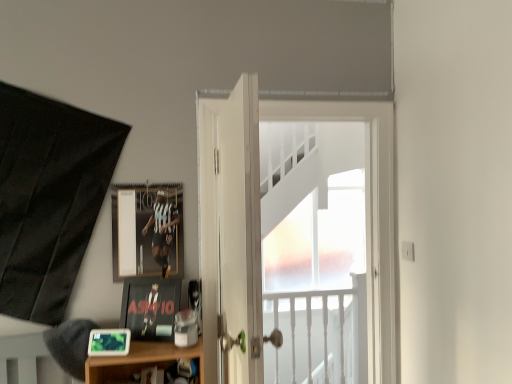
Question: Considering the relative positions of matte black picture frame at lower left, acting as the 3th picture frame starting from the top, and white glossy door at center, positioned as the second door in front-to-back order, in the image provided, is matte black picture frame at lower left, acting as the 3th picture frame starting from the top, to the right of white glossy door at center, positioned as the second door in front-to-back order, from the viewer's perspective?

Choices:
 (A) no
 (B) yes

Answer: (A)

Question: Is matte black picture frame at lower left, which is the 1th picture frame from front to back, smaller than white glossy door at center, marked as the first door in a back-to-front arrangement?

Choices:
 (A) no
 (B) yes

Answer: (B)

Question: Does matte black picture frame at lower left, the third picture frame from the back, lie in front of white glossy door at center, marked as the first door in a back-to-front arrangement?

Choices:
 (A) no
 (B) yes

Answer: (B)

Question: From the image's perspective, is matte black picture frame at lower left, which is the 1th picture frame from front to back, below white glossy door at center, marked as the first door in a back-to-front arrangement?

Choices:
 (A) yes
 (B) no

Answer: (A)

Question: Considering the relative sizes of matte black picture frame at lower left, which is the 1th picture frame from front to back, and white glossy door at center, marked as the first door in a back-to-front arrangement, in the image provided, is matte black picture frame at lower left, which is the 1th picture frame from front to back, taller than white glossy door at center, marked as the first door in a back-to-front arrangement,?

Choices:
 (A) yes
 (B) no

Answer: (B)

Question: Is matte black picture frame at lower left, placed as the first picture frame when sorted from bottom to top, looking in the opposite direction of white glossy door at center, positioned as the second door in front-to-back order?

Choices:
 (A) yes
 (B) no

Answer: (B)

Question: From a real-world perspective, is metallic silver picture frame at upper left, marked as the first picture frame in a top-to-bottom arrangement, on top of matte black picture frame at lower left, the second picture frame viewed from the front?

Choices:
 (A) no
 (B) yes

Answer: (B)

Question: Could you tell me if metallic silver picture frame at upper left, marked as the first picture frame in a top-to-bottom arrangement, is facing matte black picture frame at lower left, marked as the 2th picture frame in a back-to-front arrangement?

Choices:
 (A) no
 (B) yes

Answer: (A)

Question: Considering the relative positions of metallic silver picture frame at upper left, the 1th picture frame in the back-to-front sequence, and matte black picture frame at lower left, the second picture frame from the top, in the image provided, is metallic silver picture frame at upper left, the 1th picture frame in the back-to-front sequence, in front of matte black picture frame at lower left, the second picture frame from the top,?

Choices:
 (A) yes
 (B) no

Answer: (B)

Question: Is metallic silver picture frame at upper left, the 1th picture frame in the back-to-front sequence, not within matte black picture frame at lower left, the second picture frame from the top?

Choices:
 (A) yes
 (B) no

Answer: (A)

Question: Are metallic silver picture frame at upper left, marked as the first picture frame in a top-to-bottom arrangement, and matte black picture frame at lower left, the second picture frame from the top, located far from each other?

Choices:
 (A) no
 (B) yes

Answer: (A)

Question: Considering the relative positions of metallic silver picture frame at upper left, marked as the first picture frame in a top-to-bottom arrangement, and matte black picture frame at lower left, the second picture frame viewed from the front, in the image provided, is metallic silver picture frame at upper left, marked as the first picture frame in a top-to-bottom arrangement, to the left of matte black picture frame at lower left, the second picture frame viewed from the front, from the viewer's perspective?

Choices:
 (A) no
 (B) yes

Answer: (B)

Question: Does white wooden door at center, which is the 1th door from front to back, appear on the right side of white glossy door at center, marked as the first door in a back-to-front arrangement?

Choices:
 (A) no
 (B) yes

Answer: (A)